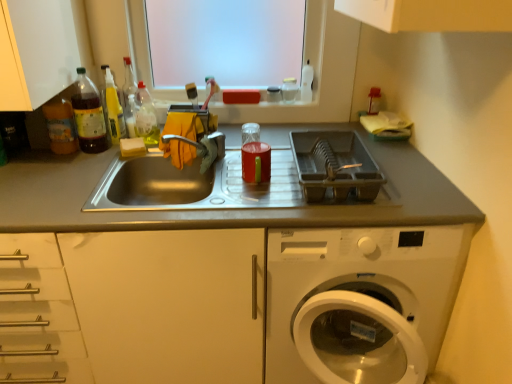
Question: Can you confirm if plastic dish rack at right is shorter than translucent plastic bottle at upper left, which ranks as the 1th bottle in right-to-left order?

Choices:
 (A) yes
 (B) no

Answer: (A)

Question: Is plastic dish rack at right to the left of translucent plastic bottle at upper left, which appears as the fourth bottle when viewed from the left, from the viewer's perspective?

Choices:
 (A) no
 (B) yes

Answer: (A)

Question: Is plastic dish rack at right bigger than translucent plastic bottle at upper left, which ranks as the 1th bottle in right-to-left order?

Choices:
 (A) yes
 (B) no

Answer: (A)

Question: Is plastic dish rack at right surrounding translucent plastic bottle at upper left, which appears as the fourth bottle when viewed from the left?

Choices:
 (A) no
 (B) yes

Answer: (A)

Question: Considering the relative sizes of plastic dish rack at right and translucent plastic bottle at upper left, which appears as the fourth bottle when viewed from the left, in the image provided, is plastic dish rack at right smaller than translucent plastic bottle at upper left, which appears as the fourth bottle when viewed from the left,?

Choices:
 (A) no
 (B) yes

Answer: (A)

Question: In terms of width, does metallic sink at center, the 2th countertop when ordered from right to left, look wider or thinner when compared to stainless steel sink at center, the first countertop in the right-to-left sequence?

Choices:
 (A) wide
 (B) thin

Answer: (A)

Question: In terms of size, does metallic sink at center, the 2th countertop when ordered from right to left, appear bigger or smaller than stainless steel sink at center, which is the 2th countertop in left-to-right order?

Choices:
 (A) big
 (B) small

Answer: (A)

Question: Is point (5, 352) positioned closer to the camera than point (407, 211)?

Choices:
 (A) farther
 (B) closer

Answer: (A)

Question: From a real-world perspective, is metallic sink at center, the 2th countertop when ordered from right to left, physically located above or below stainless steel sink at center, which is the 2th countertop in left-to-right order?

Choices:
 (A) above
 (B) below

Answer: (B)

Question: From the image's perspective, is metallic sink at center, positioned as the 1th countertop in left-to-right order, positioned above or below transparent plastic window screen at upper center?

Choices:
 (A) below
 (B) above

Answer: (A)

Question: In terms of size, does metallic sink at center, positioned as the 1th countertop in left-to-right order, appear bigger or smaller than transparent plastic window screen at upper center?

Choices:
 (A) big
 (B) small

Answer: (A)

Question: Is point (399, 276) positioned closer to the camera than point (159, 54)?

Choices:
 (A) farther
 (B) closer

Answer: (B)

Question: From a real-world perspective, is metallic sink at center, the 2th countertop when ordered from right to left, positioned above or below transparent plastic window screen at upper center?

Choices:
 (A) above
 (B) below

Answer: (B)

Question: Is translucent plastic bottle at upper left, which appears as the fourth bottle when viewed from the left, to the left or to the right of plastic dish rack at right in the image?

Choices:
 (A) left
 (B) right

Answer: (A)

Question: In terms of height, does translucent plastic bottle at upper left, which ranks as the 1th bottle in right-to-left order, look taller or shorter compared to plastic dish rack at right?

Choices:
 (A) tall
 (B) short

Answer: (A)